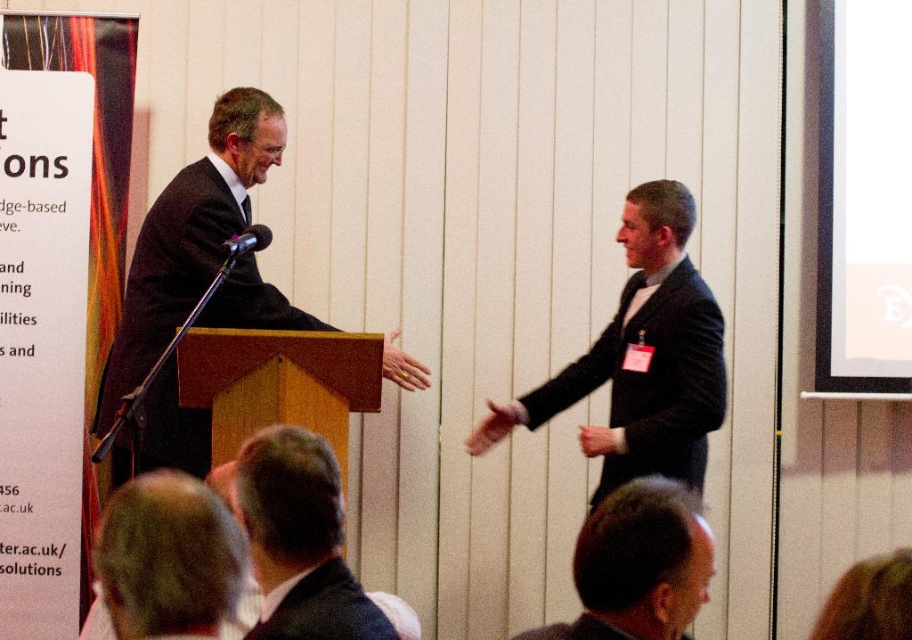
Question: Does black matte suit at right have a larger size compared to brown leather jacket at lower right?

Choices:
 (A) yes
 (B) no

Answer: (A)

Question: Which point is farther to the camera?

Choices:
 (A) black matte suit at center
 (B) dark brown hair at lower center
 (C) gray hair at lower center

Answer: (A)

Question: Which point is closer to the camera?

Choices:
 (A) (649, 465)
 (B) (284, 442)
 (C) (307, 630)
 (D) (264, 230)

Answer: (C)

Question: Among these objects, which one is nearest to the camera?

Choices:
 (A) dark brown hair at lower center
 (B) brown leather jacket at lower right

Answer: (B)

Question: Considering the relative positions of dark suit at left and black matte suit at right in the image provided, where is dark suit at left located with respect to black matte suit at right?

Choices:
 (A) right
 (B) left

Answer: (B)

Question: Is gray hair at lower center bigger than brown leather jacket at lower right?

Choices:
 (A) no
 (B) yes

Answer: (B)